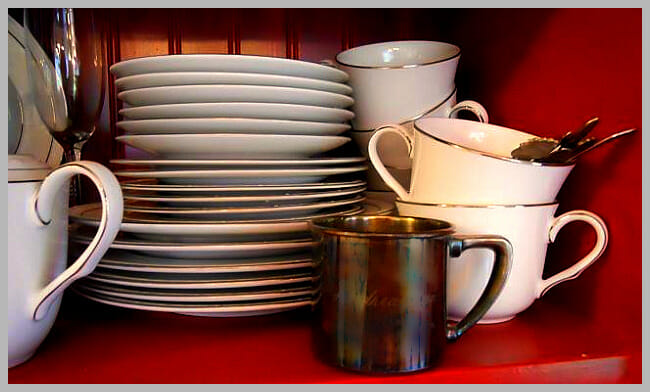
Locate an element on the screen. The height and width of the screenshot is (392, 650). silverware is located at coordinates (539, 147), (554, 155), (567, 143), (580, 141), (595, 145).